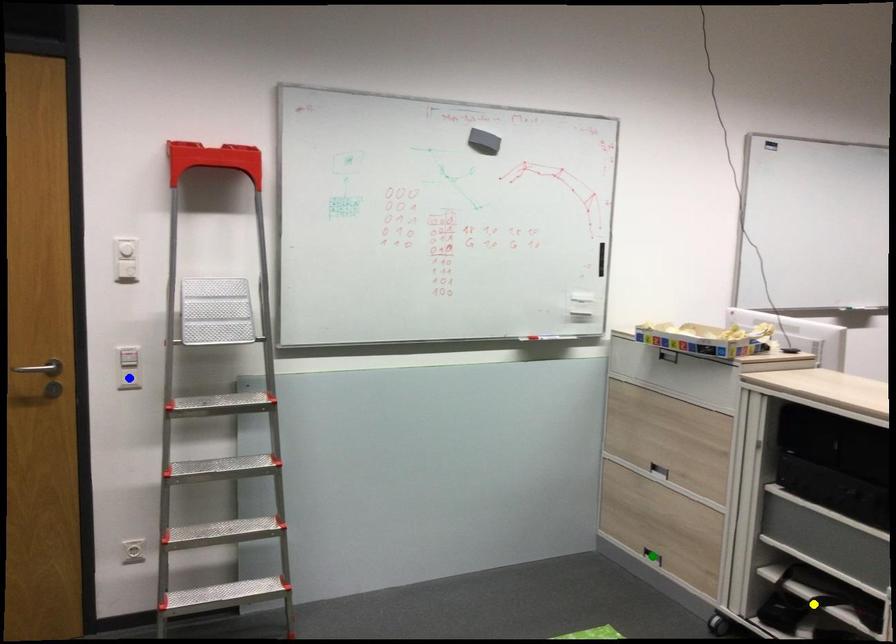
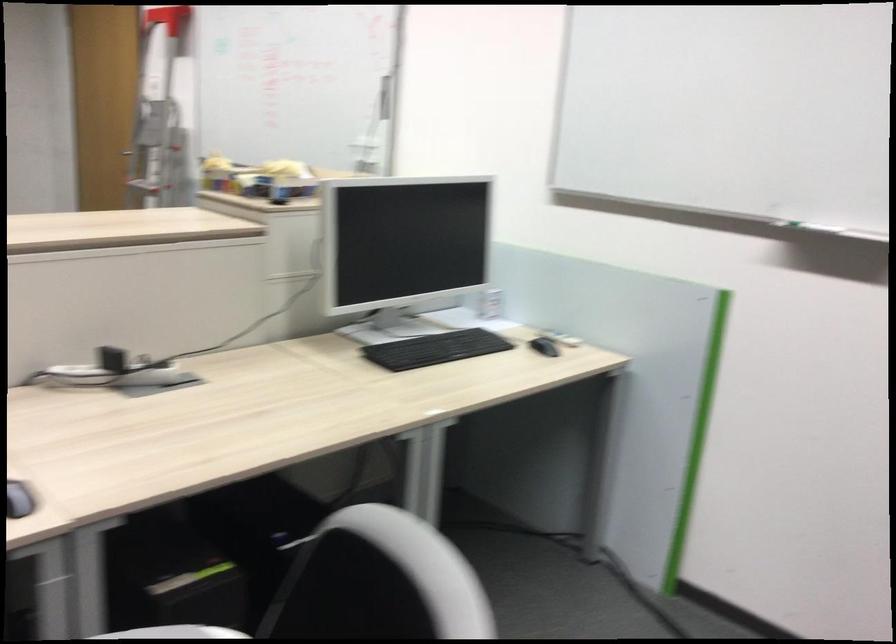
I am providing you with two images of the same scene from different viewpoints. Three points are marked in image1. Which point corresponds to a part or object that is occluded in image2?In image1, three points are marked. Which of them correspond to a part or object that is occluded in image2?Among the three points shown in image1, which one corresponds to a part or object that is no longer visible due to occlusion in image2?

Invisible in image2: green point, blue point, yellow point.